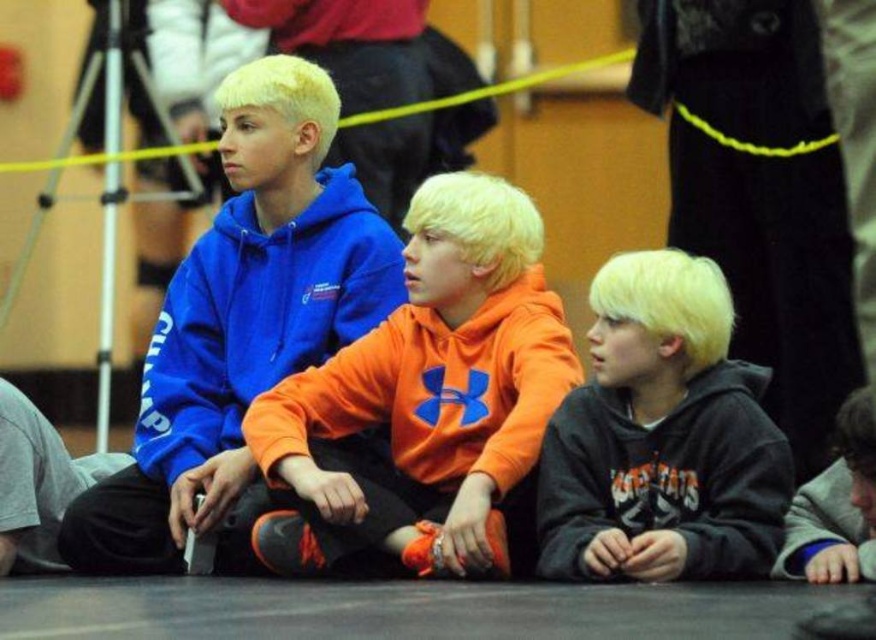
Can you confirm if orange fleece sweatshirt at center is positioned below black matte hoodie at center?

No.

Can you confirm if orange fleece sweatshirt at center is positioned to the left of black matte hoodie at center?

Correct, you'll find orange fleece sweatshirt at center to the left of black matte hoodie at center.

The height and width of the screenshot is (640, 876). I want to click on orange fleece sweatshirt at center, so click(429, 388).

Locate an element on the screen. orange fleece sweatshirt at center is located at coordinates (429, 388).

Is matte blue hoodie at upper left thinner than matte blue hoodie at left?

In fact, matte blue hoodie at upper left might be wider than matte blue hoodie at left.

Is point (401, 257) in front of point (389, 294)?

No.

Does point (238, 166) lie behind point (260, 298)?

That is True.

Where is `matte blue hoodie at upper left`? matte blue hoodie at upper left is located at coordinates (241, 324).

Describe the element at coordinates (662, 436) in the screenshot. I see `black matte hoodie at center` at that location.

Image resolution: width=876 pixels, height=640 pixels. What do you see at coordinates (662, 436) in the screenshot? I see `black matte hoodie at center` at bounding box center [662, 436].

Find the location of a particular element. This screenshot has width=876, height=640. black matte hoodie at center is located at coordinates (662, 436).